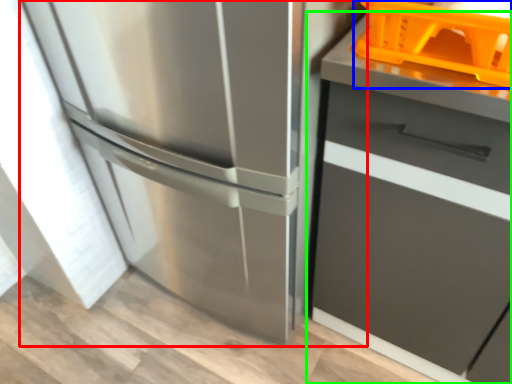
Question: Based on their relative distances, which object is nearer to refrigerator (highlighted by a red box)? Choose from basket (highlighted by a blue box) and cabinetry (highlighted by a green box).

Choices:
 (A) basket
 (B) cabinetry

Answer: (B)